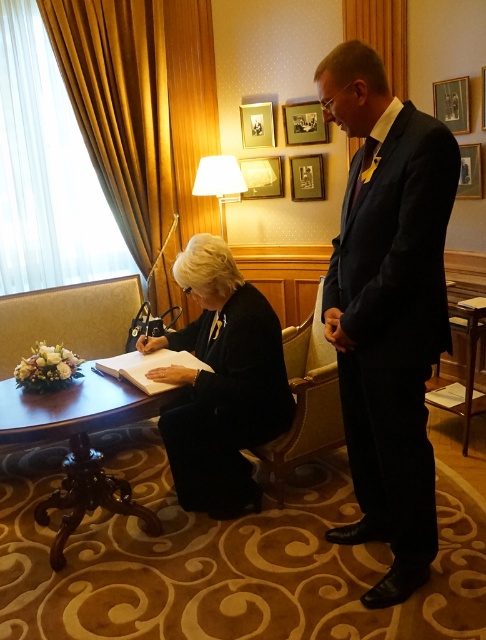
You are standing at the entrance of the room and want to move to the wooden table at lower right. Is the mahogany wood round table at lower left blocking your path?

Yes, the mahogany wood round table at lower left is blocking your path to the wooden table at lower right because it is positioned in front of it.

In the scene shown: You are a photographer positioned at the entrance of the room. You need to capture a clear photo of the navy blue suit at center without the wooden table at lower right blocking the view. Is this possible?

The navy blue suit at center is in front of the wooden table at lower right, so the table is behind the suit. Therefore, the photographer can capture a clear photo of the navy blue suit at center without the wooden table at lower right blocking the view because the suit is positioned in front.